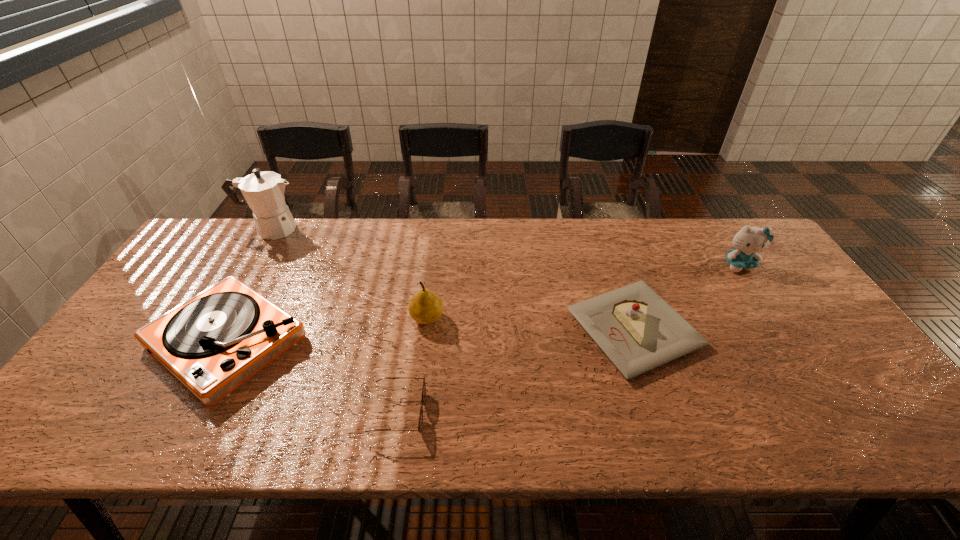
The height and width of the screenshot is (540, 960). Identify the location of vacant area between the record player and the tallest object. (250, 286).

This screenshot has width=960, height=540. Identify the location of vacant region between the farthest object and the second object from right to left. (453, 279).

Where is `free space between the pear and the second object from right to left`? The image size is (960, 540). free space between the pear and the second object from right to left is located at coordinates (531, 324).

At what (x,y) coordinates should I click in order to perform the action: click on free space between the coffeepot and the second farthest object. Please return your answer as a coordinate pair (x, y). The height and width of the screenshot is (540, 960). Looking at the image, I should click on (505, 247).

Where is `empty space between the pear and the tallest object`? This screenshot has width=960, height=540. empty space between the pear and the tallest object is located at coordinates (349, 274).

You are a GUI agent. You are given a task and a screenshot of the screen. Output one action in this format:
    pyautogui.click(x=<x>, y=<y>)
    Task: Click on the free spot between the kitten and the record player
    
    Given the screenshot: What is the action you would take?
    pyautogui.click(x=483, y=303)

Identify the location of free space between the tallest object and the cake. Image resolution: width=960 pixels, height=540 pixels. (453, 279).

What are the coordinates of `vacant space that's between the record player and the pear` in the screenshot? It's located at (327, 330).

Find the location of `vacant space in between the record player and the shortest object`. vacant space in between the record player and the shortest object is located at coordinates click(312, 377).

Identify which object is the fourth closest to the cake. Please provide its 2D coordinates. Your answer should be formatted as a tuple, i.e. [(x, y)], where the tuple contains the x and y coordinates of a point satisfying the conditions above.

[(212, 343)]